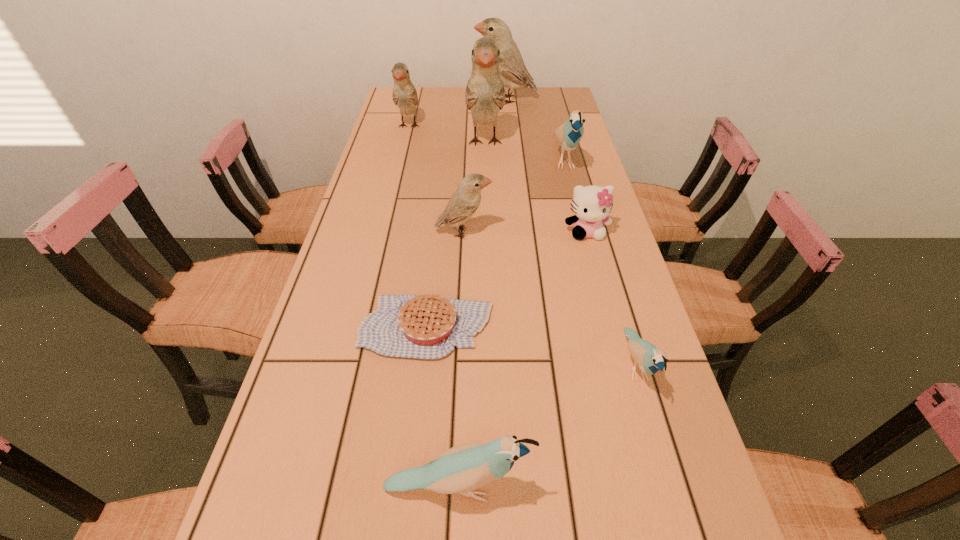
Locate an element on the screen. The height and width of the screenshot is (540, 960). the tallest object is located at coordinates (485, 94).

The height and width of the screenshot is (540, 960). Identify the location of the tallest bird. (485, 94).

This screenshot has width=960, height=540. What are the coordinates of `the farthest object` in the screenshot? It's located at (513, 72).

Find the location of a particular element. the farthest white bird is located at coordinates (513, 72).

Find the location of `the second smallest white bird`. the second smallest white bird is located at coordinates (405, 96).

The image size is (960, 540). What are the coordinates of `the leftmost white bird` in the screenshot? It's located at (405, 96).

Find the location of a particular element. The width and height of the screenshot is (960, 540). the biggest blue bird is located at coordinates (568, 135).

The width and height of the screenshot is (960, 540). Identify the location of the nearest white bird. (465, 201).

The image size is (960, 540). I want to click on the smallest white bird, so click(465, 201).

This screenshot has height=540, width=960. I want to click on the nearest blue bird, so click(461, 469).